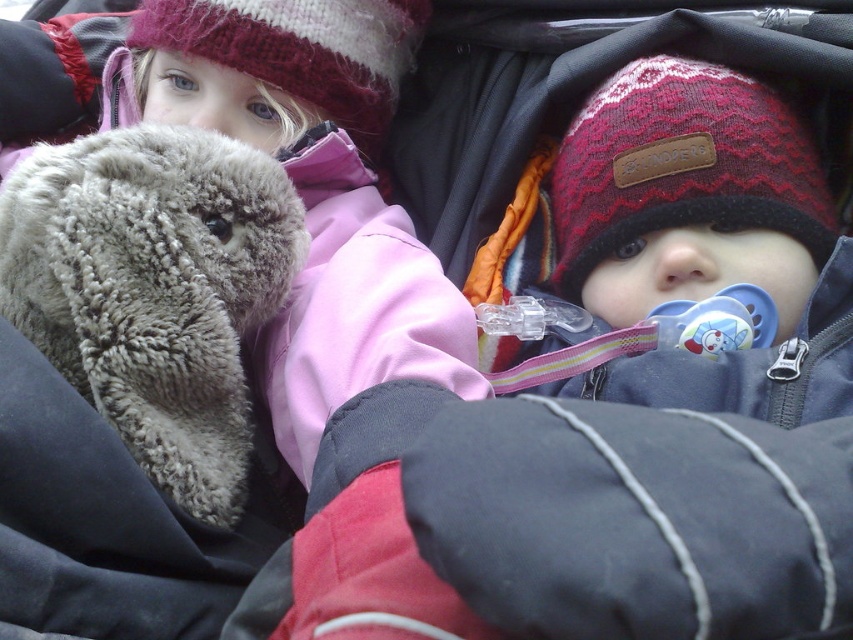
Question: Is fuzzy gray teddy bear at left smaller than knitted woolen hat at upper left?

Choices:
 (A) yes
 (B) no

Answer: (B)

Question: Does fuzzy gray teddy bear at left have a smaller size compared to knitted woolen hat at upper left?

Choices:
 (A) yes
 (B) no

Answer: (B)

Question: Which point is closer to the camera?

Choices:
 (A) (265, 77)
 (B) (566, 248)
 (C) (322, 301)
 (D) (10, 225)

Answer: (D)

Question: Can you confirm if fuzzy gray teddy bear at left is positioned above knitted woolen hat at upper left?

Choices:
 (A) yes
 (B) no

Answer: (B)

Question: Among these points, which one is nearest to the camera?

Choices:
 (A) (195, 349)
 (B) (459, 376)

Answer: (A)

Question: Which of the following is the farthest from the observer?

Choices:
 (A) knitted woolen hat at upper left
 (B) knitted woolen hat at upper right
 (C) fuzzy gray stuffed animal at left

Answer: (A)